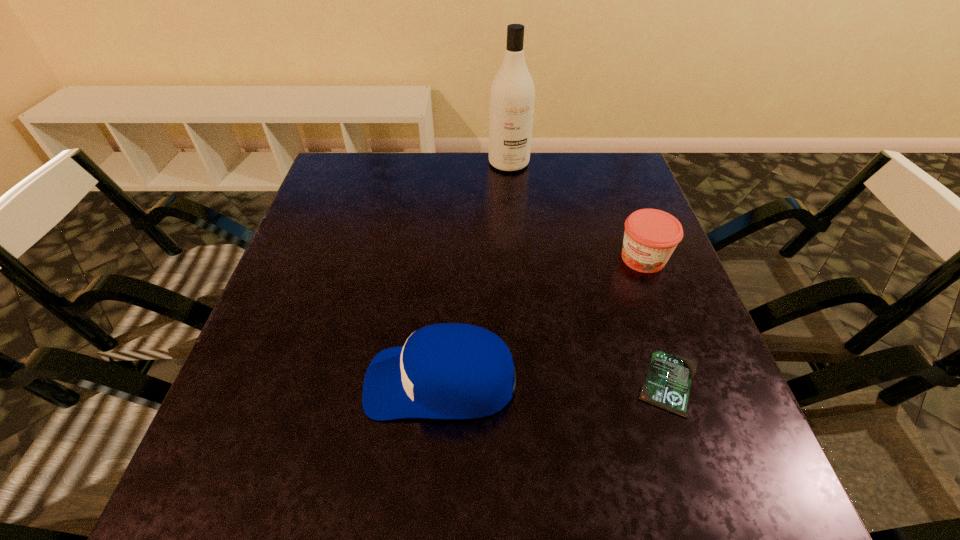
This screenshot has height=540, width=960. Identify the location of object at the near right corner. (667, 386).

Locate an element on the screen. blank space at the far edge of the desktop is located at coordinates (480, 199).

You are a GUI agent. You are given a task and a screenshot of the screen. Output one action in this format:
    pyautogui.click(x=<x>, y=<y>)
    Task: Click on the vacant area at the near edge of the desktop
    This screenshot has height=540, width=960.
    Given the screenshot: What is the action you would take?
    pyautogui.click(x=529, y=417)

You are a GUI agent. You are given a task and a screenshot of the screen. Output one action in this format:
    pyautogui.click(x=<x>, y=<y>)
    Task: Click on the free space at the left edge
    This screenshot has width=960, height=540.
    Given the screenshot: What is the action you would take?
    pyautogui.click(x=274, y=360)

Image resolution: width=960 pixels, height=540 pixels. In the image, there is a desktop. Identify the location of free space at the right edge. (591, 203).

The width and height of the screenshot is (960, 540). In the image, there is a desktop. Identify the location of vacant region at the far right corner. (591, 180).

You are a GUI agent. You are given a task and a screenshot of the screen. Output one action in this format:
    pyautogui.click(x=<x>, y=<y>)
    Task: Click on the unoccupied area between the jam and the shortest object
    
    Given the screenshot: What is the action you would take?
    pyautogui.click(x=657, y=321)

Identify the location of free space between the baseball cap and the tallest object. This screenshot has height=540, width=960. pos(475,272).

Locate an element on the screen. Image resolution: width=960 pixels, height=540 pixels. vacant space that's between the jam and the tallest object is located at coordinates (576, 211).

Image resolution: width=960 pixels, height=540 pixels. What are the coordinates of `free area in between the shortest object and the baseball cap` in the screenshot? It's located at (555, 382).